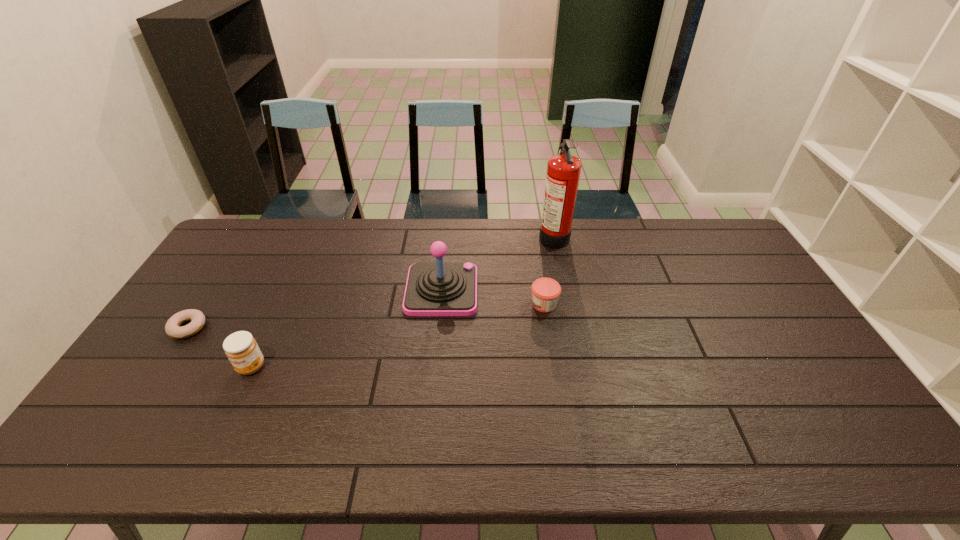
Image resolution: width=960 pixels, height=540 pixels. Find the location of `the tallest object`. the tallest object is located at coordinates (563, 172).

Image resolution: width=960 pixels, height=540 pixels. What are the coordinates of `fire extinguisher` in the screenshot? It's located at (563, 172).

Identify the location of joystick. Image resolution: width=960 pixels, height=540 pixels. (432, 289).

Find the location of `the second tallest object`. the second tallest object is located at coordinates (432, 289).

You are a GUI agent. You are given a task and a screenshot of the screen. Output one action in this format:
    pyautogui.click(x=<x>, y=<y>)
    Task: Click on the third shortest object
    The width and height of the screenshot is (960, 540).
    Given the screenshot: What is the action you would take?
    pyautogui.click(x=241, y=348)

In order to click on the taller jam in this screenshot , I will do pos(241,348).

Find the location of `the shorter jam`. the shorter jam is located at coordinates (545, 291).

Image resolution: width=960 pixels, height=540 pixels. In order to click on the second shortest object in this screenshot , I will do `click(545, 291)`.

Locate an element on the screen. the shortest object is located at coordinates (172, 328).

Where is `the leftmost object`? The width and height of the screenshot is (960, 540). the leftmost object is located at coordinates (172, 328).